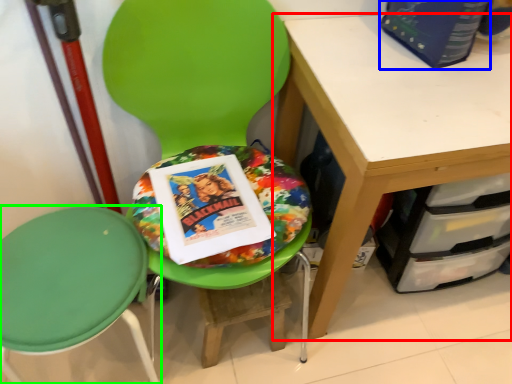
Question: Which object is positioned farthest from desk (highlighted by a red box)? Select from paperback book (highlighted by a blue box) and chair (highlighted by a green box).

Choices:
 (A) paperback book
 (B) chair

Answer: (B)